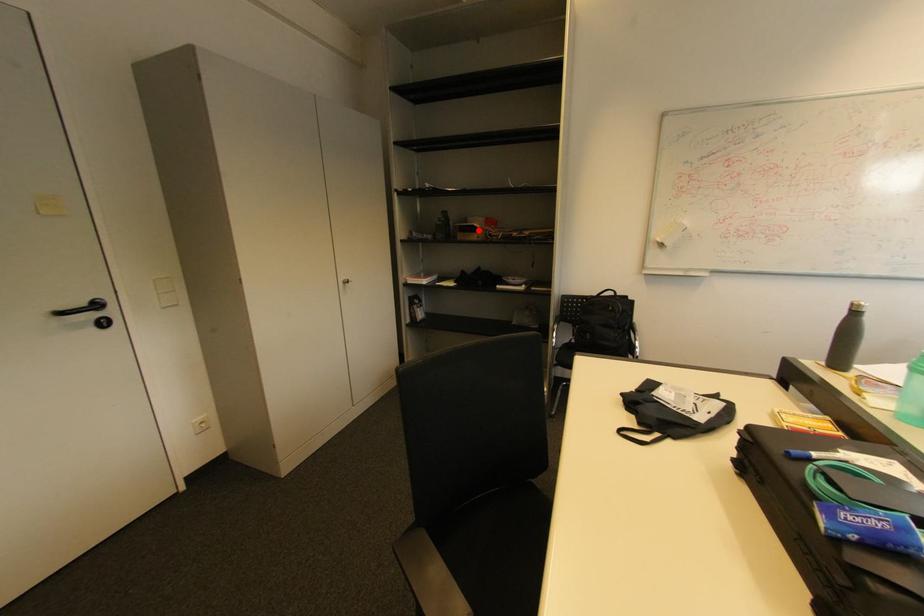
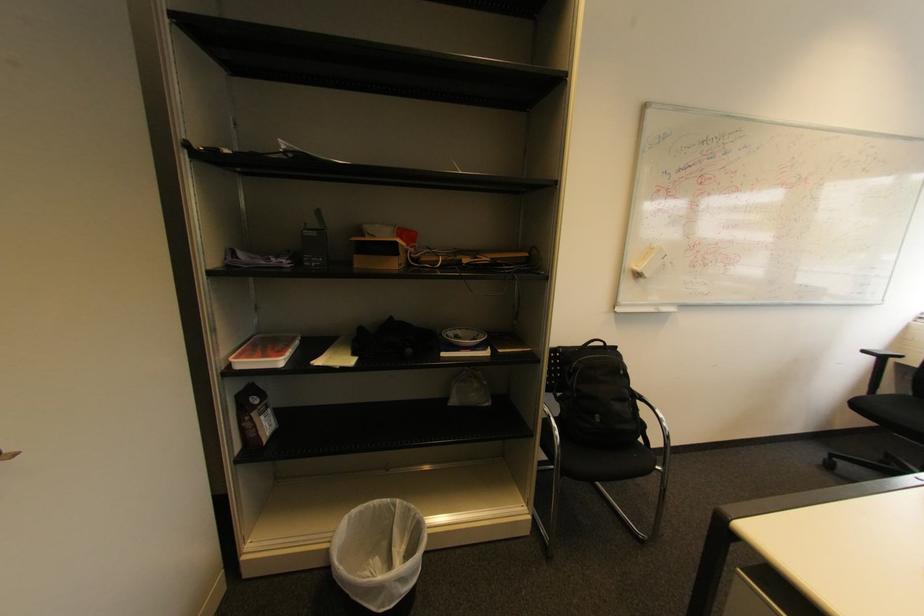
Where in the second image is the point corresponding to the highlighted location from the first image?

(395, 251)